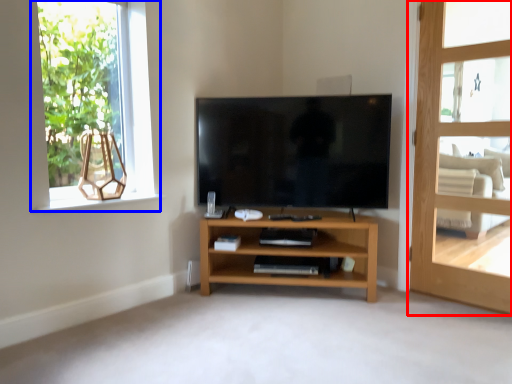
Question: Which point is further to the camera, door (highlighted by a red box) or window (highlighted by a blue box)?

Choices:
 (A) door
 (B) window

Answer: (B)